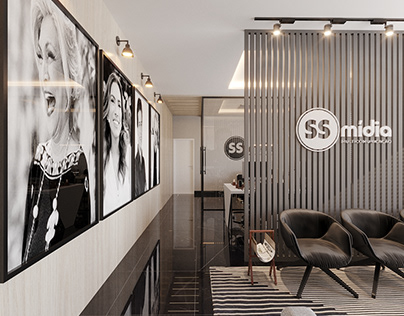
The height and width of the screenshot is (316, 404). I want to click on bulb, so click(x=128, y=45).